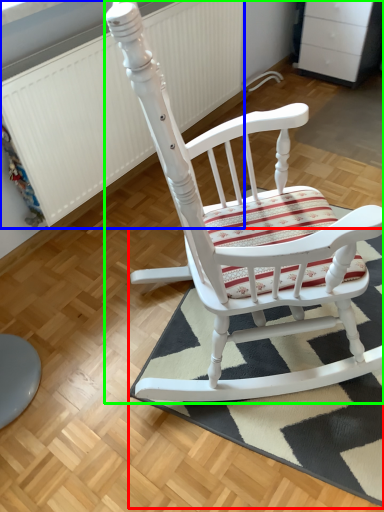
Question: Which object is positioned closest to doormat (highlighted by a red box)? Select from radiator (highlighted by a blue box) and chair (highlighted by a green box).

Choices:
 (A) radiator
 (B) chair

Answer: (B)